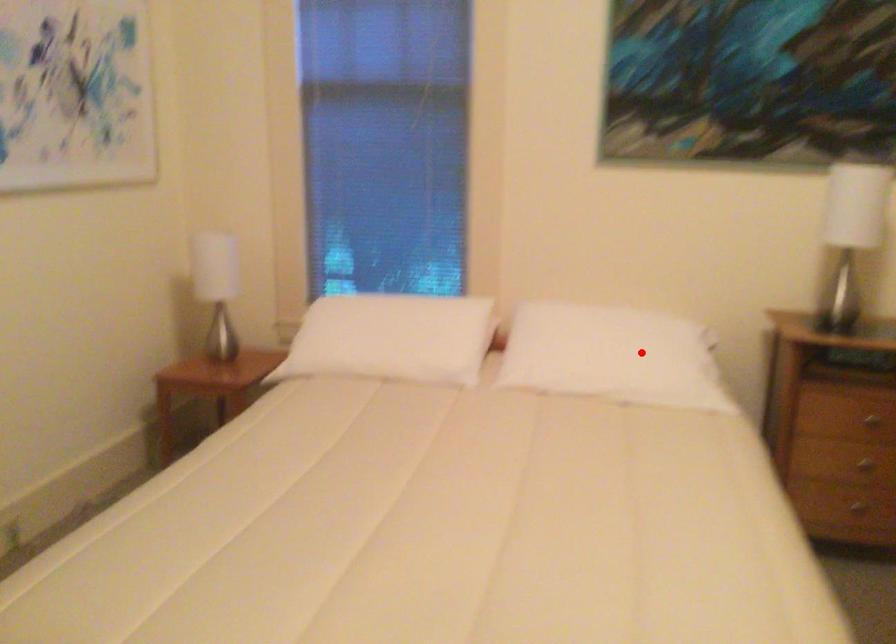
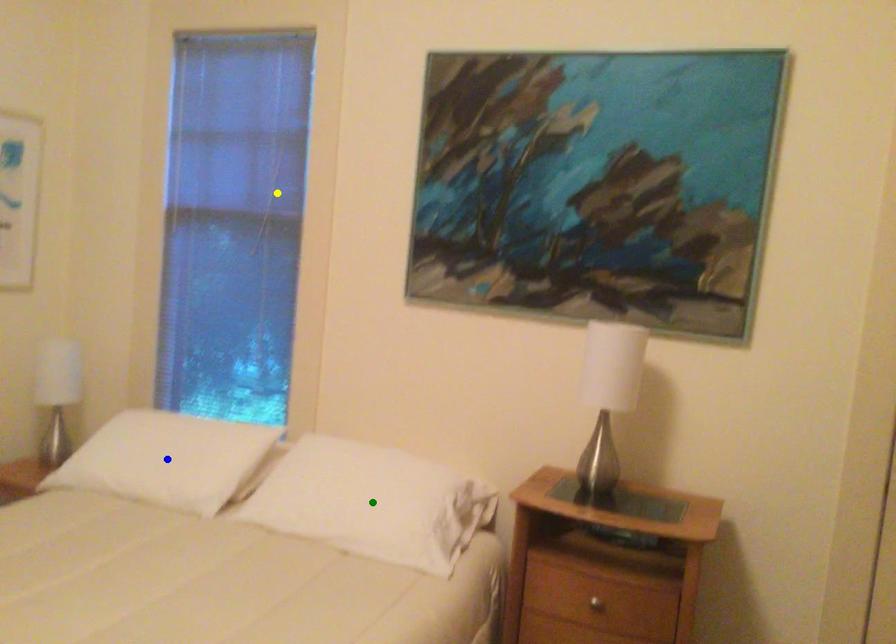
Question: I am providing you with two images of the same scene from different viewpoints. A red point is marked on the first image. You are given multiple points on the second image. Which spot in image 2 lines up with the point in image 1?

Choices:
 (A) blue point
 (B) green point
 (C) yellow point

Answer: (B)